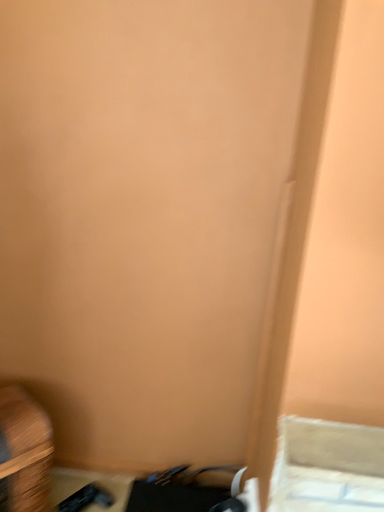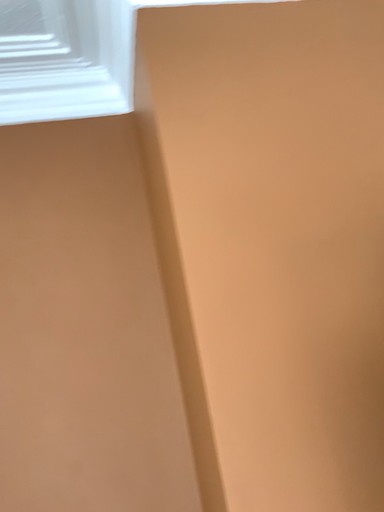
Question: How did the camera likely rotate when shooting the video?

Choices:
 (A) rotated left
 (B) rotated right

Answer: (B)